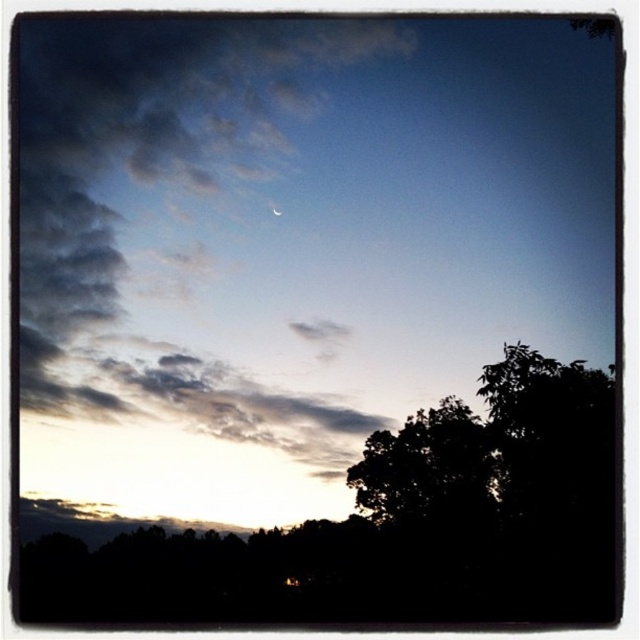
You are an astronomer observing the twilight sky. You notice the cloudy sky at upper left and the satin silver crescent at upper center. Which celestial object is positioned to the right of the other?

The satin silver crescent at upper center is positioned to the right of the cloudy sky at upper left.

You are an astronomer observing the night sky. You notice the cloudy sky at upper left and the silhouette leafy tree at lower right. Which object is located to the east if the scene is facing north?

The cloudy sky at upper left is positioned on the left side of silhouette leafy tree at lower right. Since the scene is facing north, the left side corresponds to the west direction. Therefore, the cloudy sky at upper left is west of the silhouette leafy tree at lower right, so the silhouette leafy tree at lower right is located to the east.